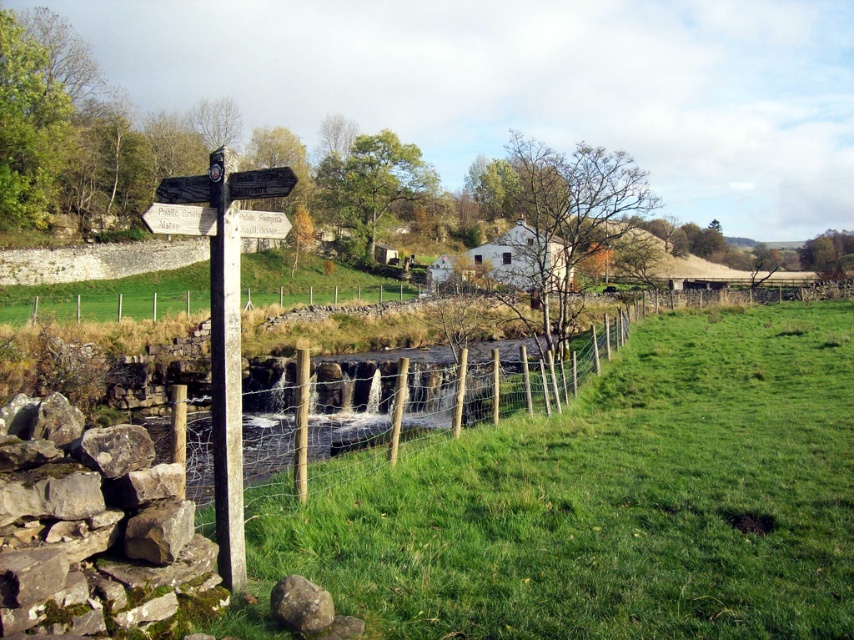
Question: Can you confirm if green grassy at center is wider than mossy stone wall at lower left?

Choices:
 (A) no
 (B) yes

Answer: (B)

Question: Which object appears farthest from the camera in this image?

Choices:
 (A) white wooden signpost at left
 (B) gray rough rock at lower left
 (C) green grassy at center
 (D) mossy stone wall at lower left

Answer: (A)

Question: Which object appears closest to the camera in this image?

Choices:
 (A) white wooden signpost at left
 (B) mossy stone wall at lower left

Answer: (B)

Question: Can you confirm if white wooden signpost at left is positioned below gray rough rock at lower left?

Choices:
 (A) yes
 (B) no

Answer: (B)

Question: Where is mossy stone wall at lower left located in relation to white wooden signpost at left in the image?

Choices:
 (A) left
 (B) right

Answer: (B)

Question: Which object is the farthest from the mossy stone wall at lower left?

Choices:
 (A) wire mesh fence at center
 (B) white wooden signpost at left

Answer: (A)